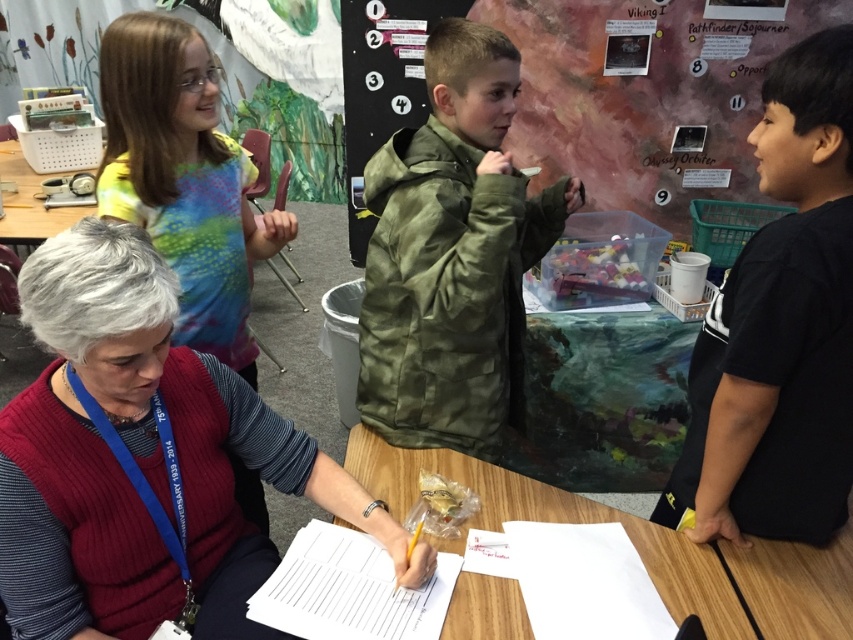
You are standing in the classroom and need to find the camouflage jacket at center. According to the coordinates provided, where exactly is the camouflage jacket located in the image?

The camouflage jacket at center is located at the 2D coordinates point (451, 256) in the image.

You are a student in this classroom and need to place a large textbook on the knitted red sweater at upper left and the wooden table at center. Which surface can accommodate the textbook without it hanging off the edge?

The knitted red sweater at upper left is bigger than the wooden table at center, so the textbook can be placed on the knitted red sweater at upper left without hanging off the edge.